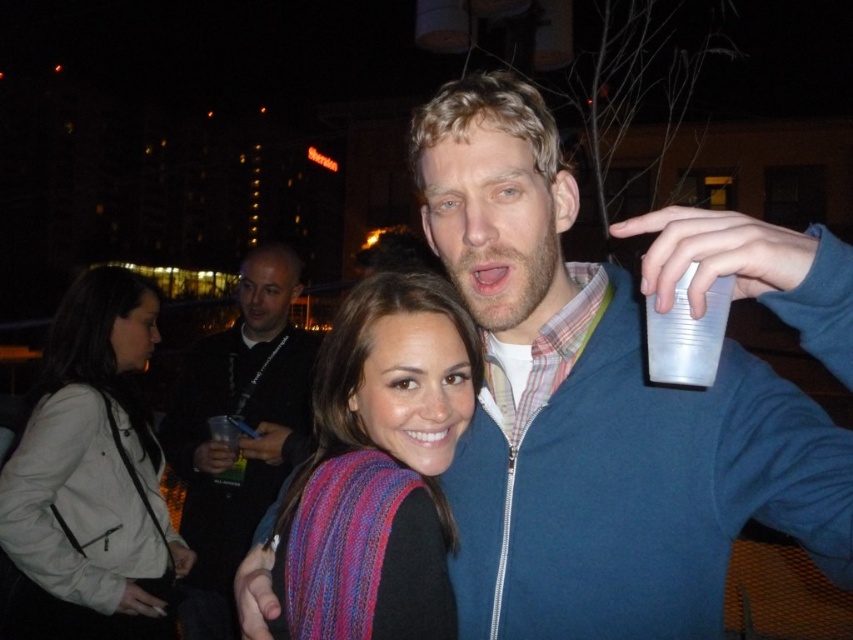
You are at a party and want to grab the transparent plastic cup at upper right without moving from your current position near the white leather jacket at lower left. Can you reach it?

The distance between the white leather jacket at lower left and the transparent plastic cup at upper right is 6.11 feet. Since the average human arm length is about 2.5 feet, you cannot reach the cup from your current position.

You are taking a photo of two people at a party. You see two points in the image labeled as point 1 and point 2. Point 1 is at position [65,416] and point 2 is at [654,356]. Which point is closer to the camera?

Point 1 at position [65,416] is closer to the camera than point 2 at [654,356].